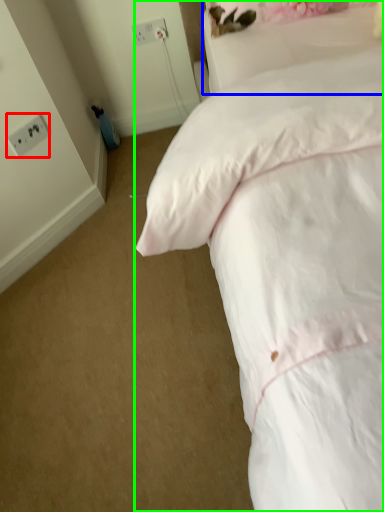
Question: Which object is positioned closest to electric outlet (highlighted by a red box)? Select from pillow (highlighted by a blue box) and bed (highlighted by a green box).

Choices:
 (A) pillow
 (B) bed

Answer: (A)